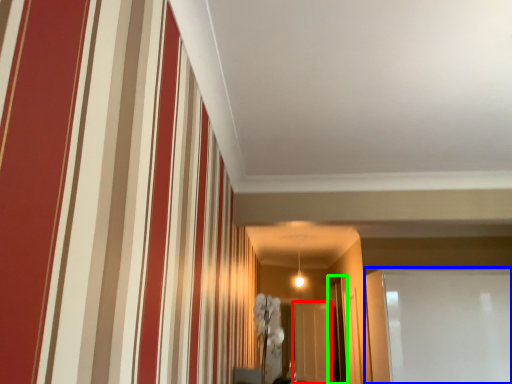
Question: Which is nearer to the glass door (highlighted by a red box)? glass door (highlighted by a blue box) or glass door (highlighted by a green box).

Choices:
 (A) glass door
 (B) glass door

Answer: (B)